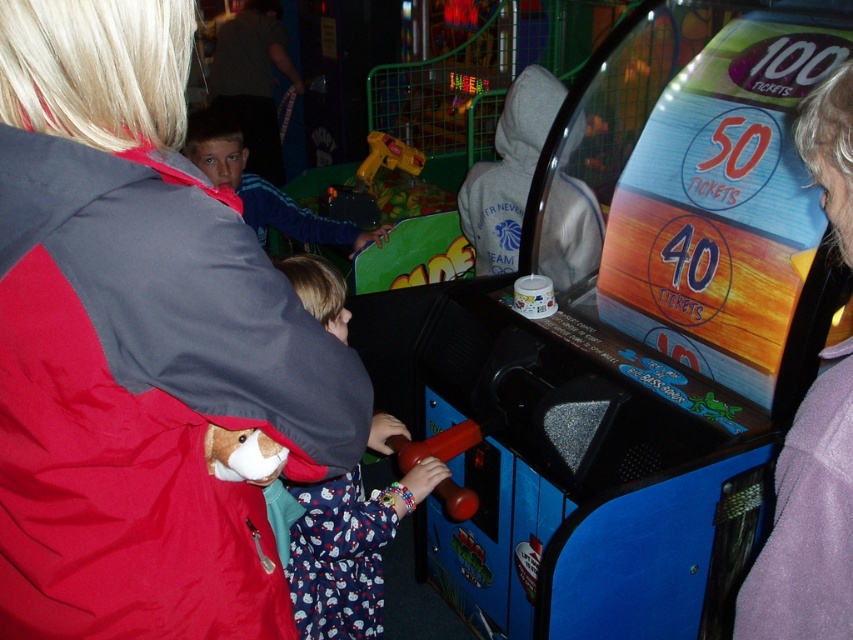
You are a person standing in an arcade. You see the matte gray jacket at center. Can you reach out and touch it without moving your feet?

The matte gray jacket at center is 25.61 inches away from the viewer. Since the average human arm span is about 25 inches, you might barely reach it but it would be difficult.

You are a game attendant in the arcade. You see the matte gray jacket at center and the yellow plastic toy gun at center. A customer wants to know which item is closer to the left side of the scene. Which one do you point to?

The matte gray jacket at center is to the left of the yellow plastic toy gun at center, so the matte gray jacket at center is closer to the left side of the scene.